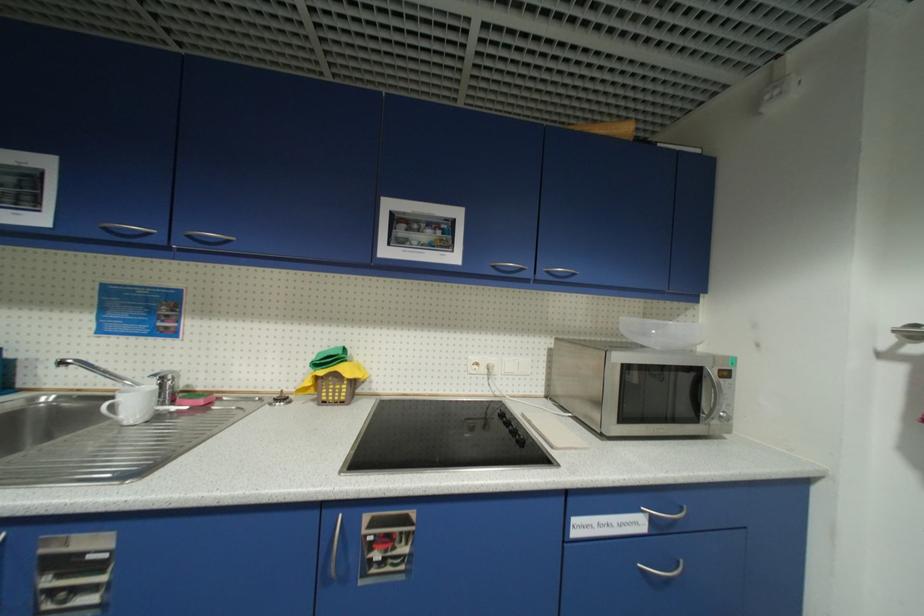
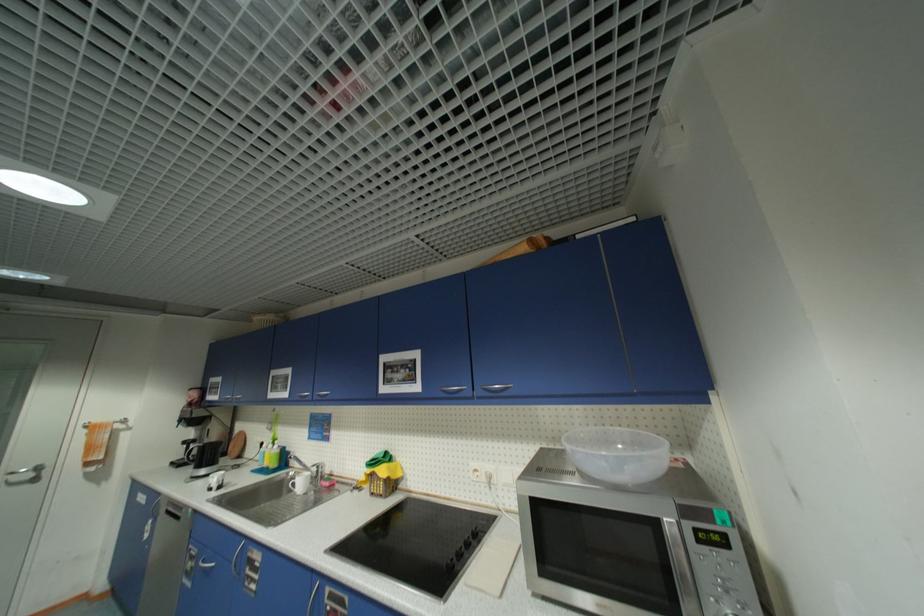
Locate, in the second image, the point that corresponds to point 327,373 in the first image.

(374, 472)